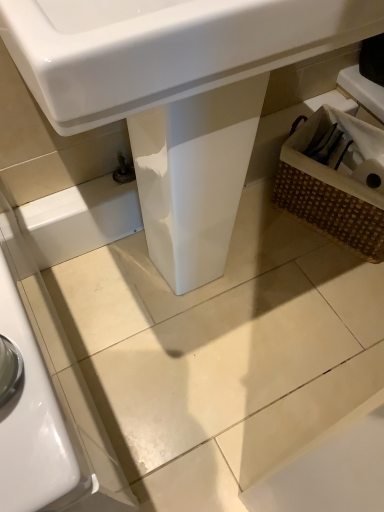
What are the coordinates of `vacant area that is situated to the right of white glossy sink at center` in the screenshot? It's located at (318, 290).